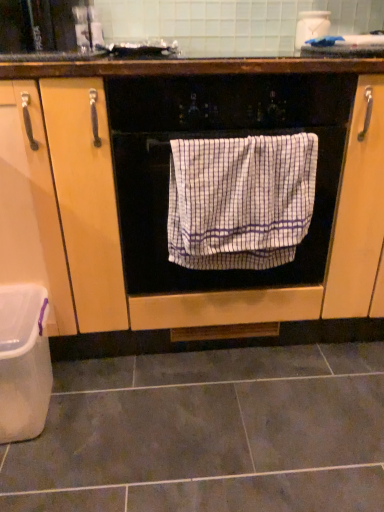
Question: Can you confirm if gray matte tile at lower center is wider than white plastic container at lower left?

Choices:
 (A) no
 (B) yes

Answer: (B)

Question: Could you tell me if gray matte tile at lower center is facing white plastic container at lower left?

Choices:
 (A) yes
 (B) no

Answer: (B)

Question: Is gray matte tile at lower center directly adjacent to white plastic container at lower left?

Choices:
 (A) yes
 (B) no

Answer: (B)

Question: Is gray matte tile at lower center completely or partially outside of white plastic container at lower left?

Choices:
 (A) yes
 (B) no

Answer: (A)

Question: Is gray matte tile at lower center further to the viewer compared to white plastic container at lower left?

Choices:
 (A) no
 (B) yes

Answer: (A)

Question: Considering the positions of white wood cabinet at center and white checkered towel at center in the image, is white wood cabinet at center taller or shorter than white checkered towel at center?

Choices:
 (A) short
 (B) tall

Answer: (B)

Question: In terms of width, does white wood cabinet at center look wider or thinner when compared to white checkered towel at center?

Choices:
 (A) thin
 (B) wide

Answer: (B)

Question: In the image, is white wood cabinet at center positioned in front of or behind white checkered towel at center?

Choices:
 (A) behind
 (B) front

Answer: (B)

Question: Considering the positions of point (62, 178) and point (279, 258), is point (62, 178) closer or farther from the camera than point (279, 258)?

Choices:
 (A) closer
 (B) farther

Answer: (A)

Question: Does point (29, 430) appear closer or farther from the camera than point (168, 297)?

Choices:
 (A) farther
 (B) closer

Answer: (B)

Question: From the image's perspective, is white plastic container at lower left located above or below white wood cabinet at center?

Choices:
 (A) above
 (B) below

Answer: (B)

Question: From a real-world perspective, is white plastic container at lower left physically located above or below white wood cabinet at center?

Choices:
 (A) below
 (B) above

Answer: (A)

Question: Is white plastic container at lower left situated inside white wood cabinet at center or outside?

Choices:
 (A) outside
 (B) inside

Answer: (A)

Question: Does point (269, 113) appear closer or farther from the camera than point (360, 389)?

Choices:
 (A) farther
 (B) closer

Answer: (B)

Question: From the image's perspective, is white checkered towel at center above or below gray matte tile at lower center?

Choices:
 (A) above
 (B) below

Answer: (A)